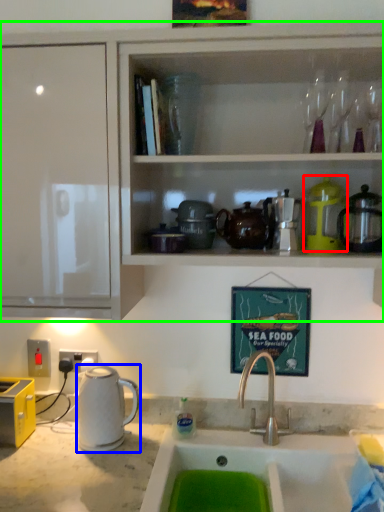
Question: Estimate the real-world distances between objects in this image. Which object is farther from appliance (highlighted by a red box), kitchen appliance (highlighted by a blue box) or cabinetry (highlighted by a green box)?

Choices:
 (A) kitchen appliance
 (B) cabinetry

Answer: (A)